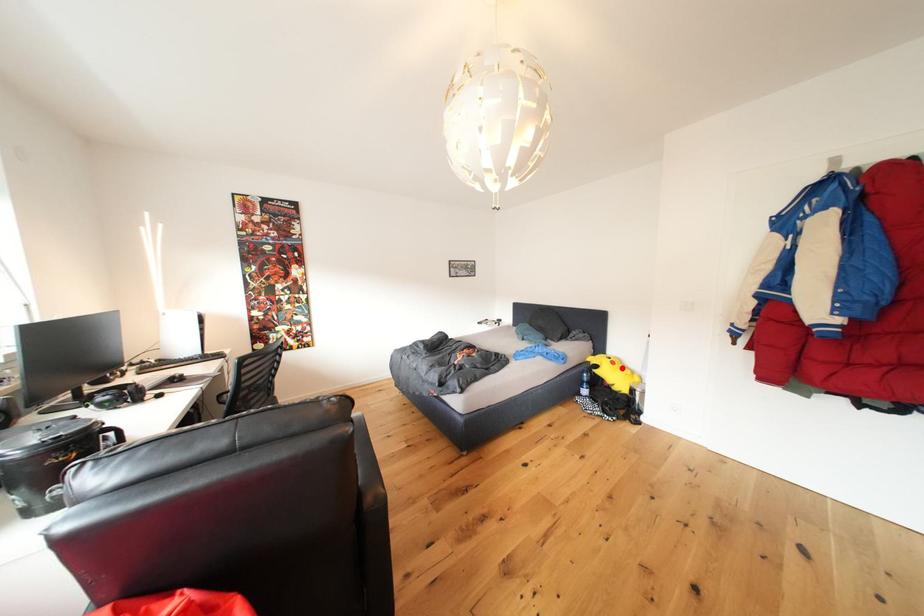
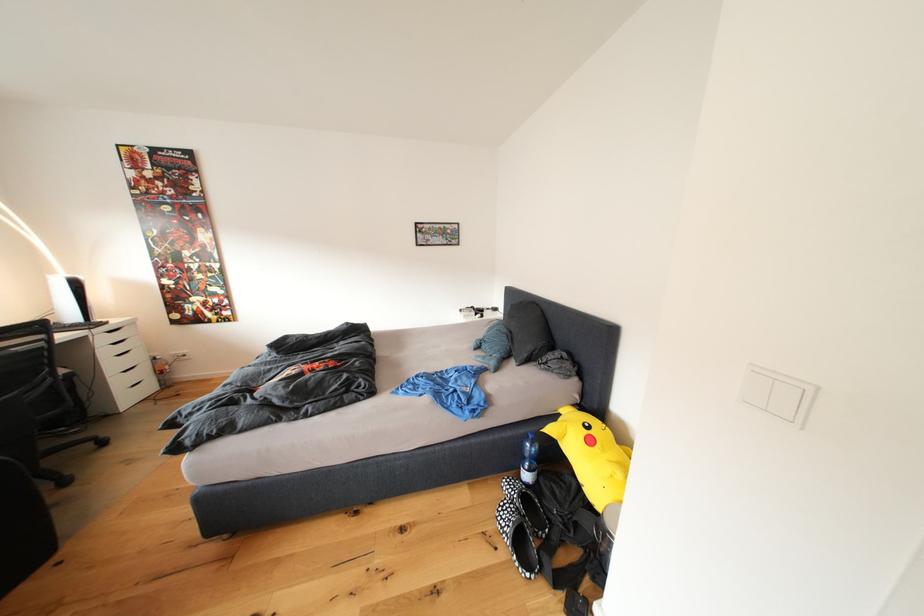
Find the pixel in the second image that matches the highlighted location in the first image.

(600, 446)